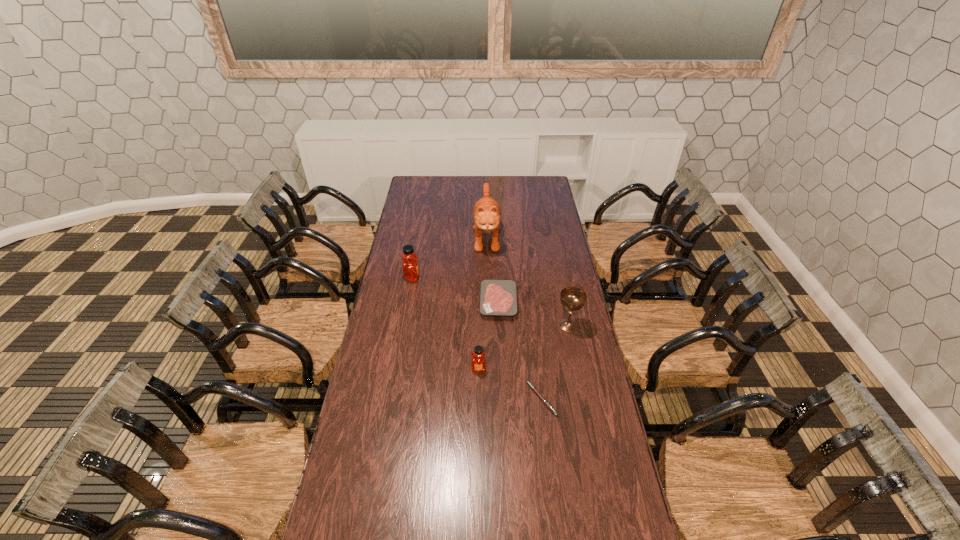
Find the location of a particular element. blank space at the far edge of the desktop is located at coordinates (517, 178).

The image size is (960, 540). I want to click on vacant space at the near edge of the desktop, so click(x=479, y=522).

Identify the location of vacant space at the left edge of the desktop. (421, 210).

Locate an element on the screen. vacant area at the right edge of the desktop is located at coordinates (567, 350).

At what (x,y) coordinates should I click in order to perform the action: click on vacant space at the far left corner of the desktop. Please return your answer as a coordinate pair (x, y). The height and width of the screenshot is (540, 960). Looking at the image, I should click on (413, 194).

Find the location of `unoccupied area between the chalice and the steak`. unoccupied area between the chalice and the steak is located at coordinates 533,313.

You are a GUI agent. You are given a task and a screenshot of the screen. Output one action in this format:
    pyautogui.click(x=<x>, y=<y>)
    Task: Click on the unoccupied position between the chalice and the shortest object
    This screenshot has width=960, height=540.
    Given the screenshot: What is the action you would take?
    pyautogui.click(x=555, y=362)

This screenshot has width=960, height=540. I want to click on free area in between the second farthest object and the fifth tallest object, so (455, 290).

The height and width of the screenshot is (540, 960). In order to click on vacant area that lies between the fourth tallest object and the shortest object in this screenshot , I will do `click(510, 384)`.

Where is `vacant area that lies between the nearer honey and the shortest object`? This screenshot has width=960, height=540. vacant area that lies between the nearer honey and the shortest object is located at coordinates (510, 384).